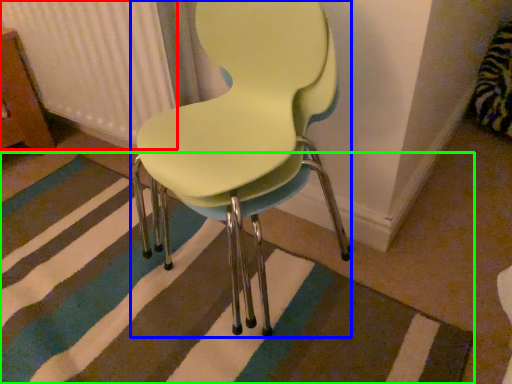
Question: Which is farther away from radiator (highlighted by a red box)? chair (highlighted by a blue box) or doormat (highlighted by a green box)?

Choices:
 (A) chair
 (B) doormat

Answer: (B)